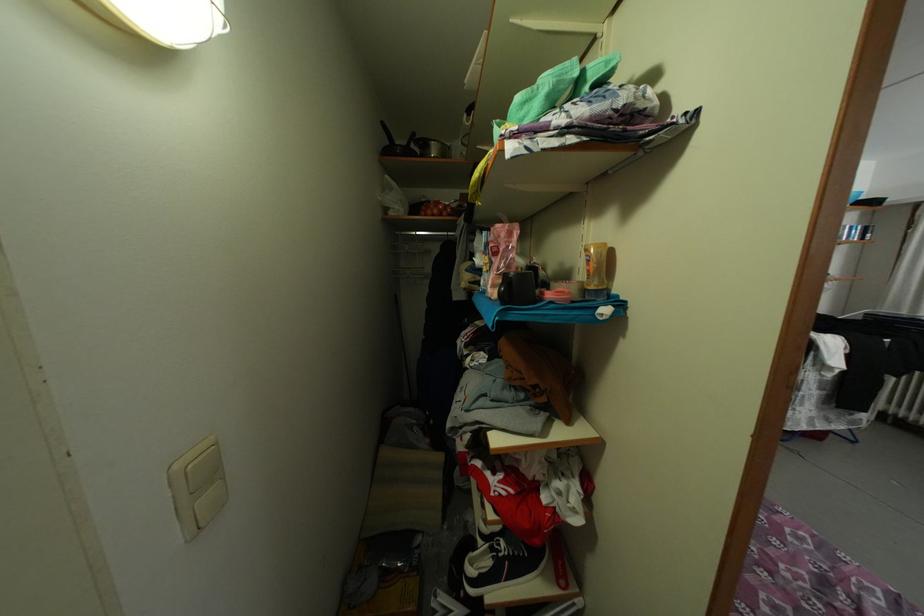
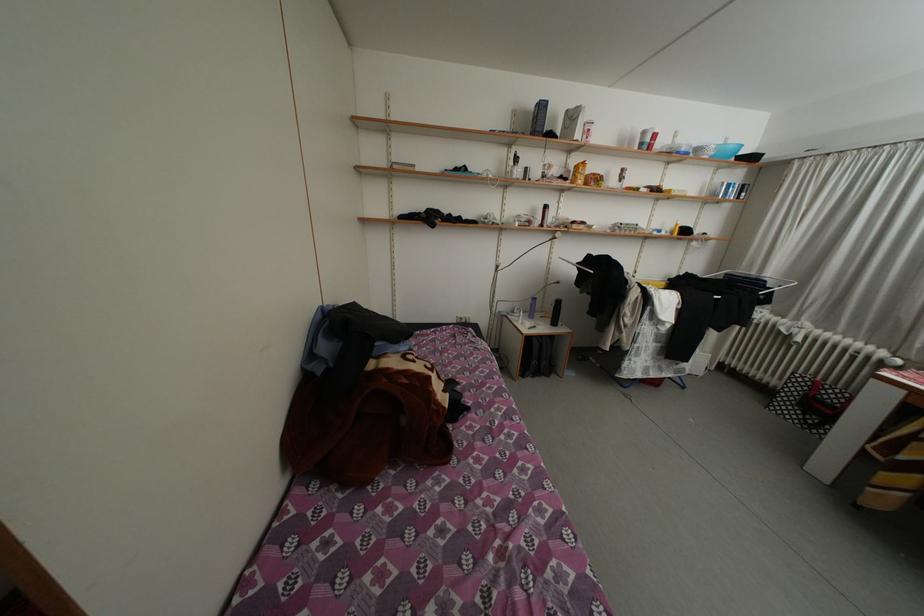
Question: In a continuous first-person perspective shot, in which direction is the camera moving?

Choices:
 (A) Left
 (B) Right
 (C) Forward
 (D) Backward

Answer: (B)